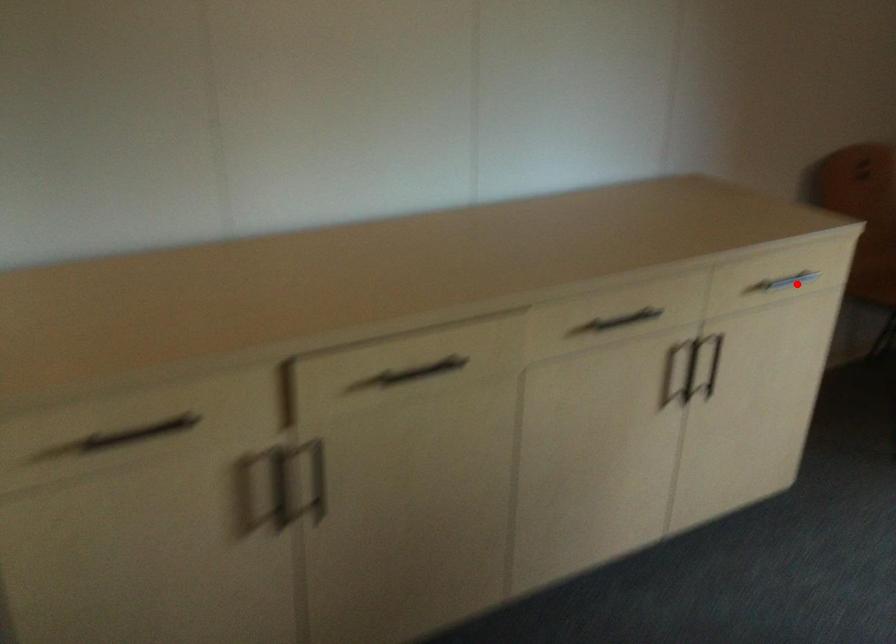
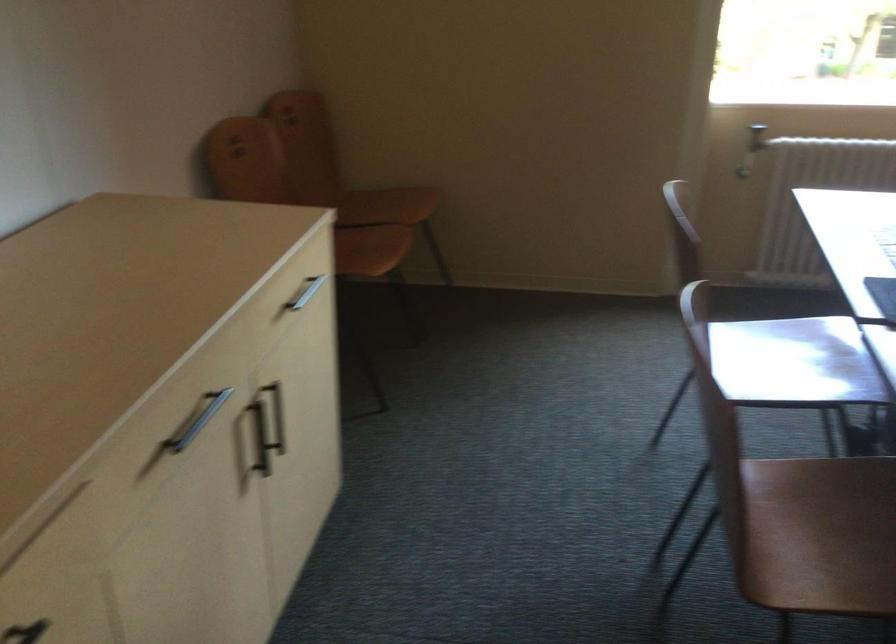
Question: I am providing you with two images of the same scene from different viewpoints. A red point is shown in image1. For the corresponding object point in image2, is it positioned nearer or farther from the camera?

Choices:
 (A) Nearer
 (B) Farther

Answer: (A)